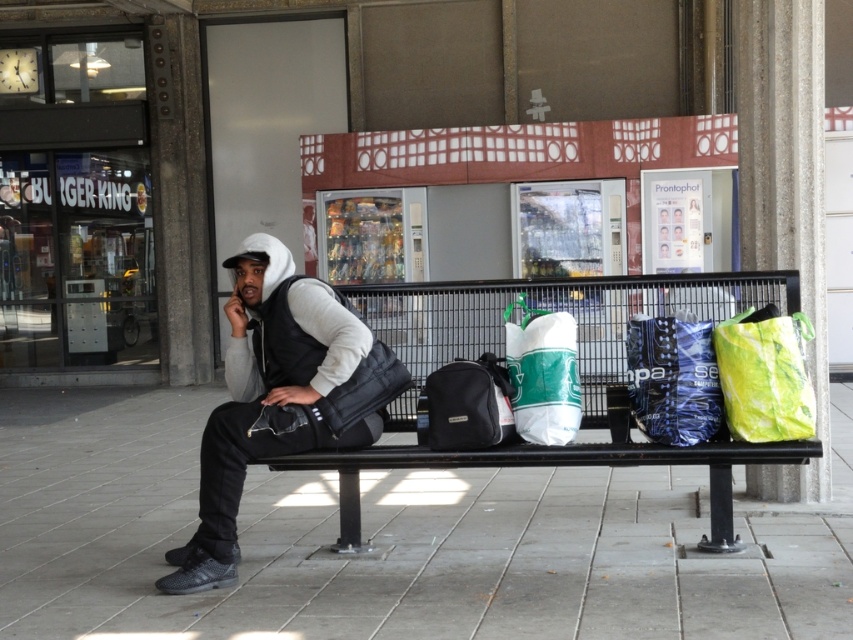
In the scene shown: You are standing in front of the bench and want to pick up the item closest to you. Which point should you reach out to, point (x=166, y=582) or point (x=474, y=428)?

Point (x=166, y=582) is further to the camera than point (x=474, y=428). Therefore, the item at point (x=474, y=428) is closer to you, so you should reach out to that point.

Based on the photo, you are a delivery person who needs to place a package on the bench. The bench has two marked points where you can place items. The first point is at coordinates point (654,403) and the second is at point (548,419). Which point is closer to the back of the bench?

Point (654,403) is behind point (548,419), so placing the package at point (654,403) would be closer to the back of the bench.

Looking at this image, you are a delivery person who needs to place a new package on the bench. The package is the same size as the blue matte bag at right. Where should you place it to ensure it fits without overlapping the green matte shopping bag at center?

The blue matte bag at right is smaller than the green matte shopping bag at center. Since the package is the same size as the blue matte bag at right, placing it to the right of the green matte shopping bag at center would ensure it doesn not overlap.